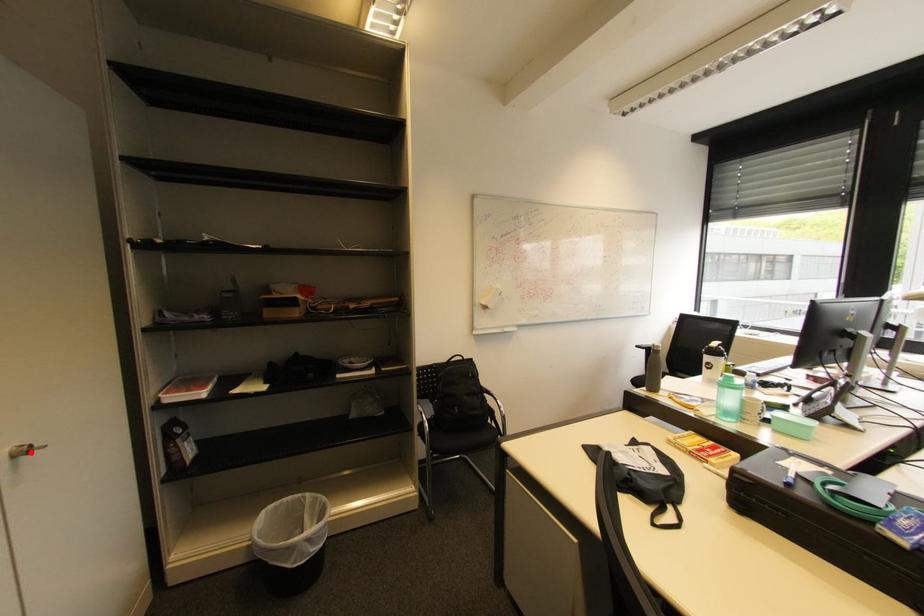
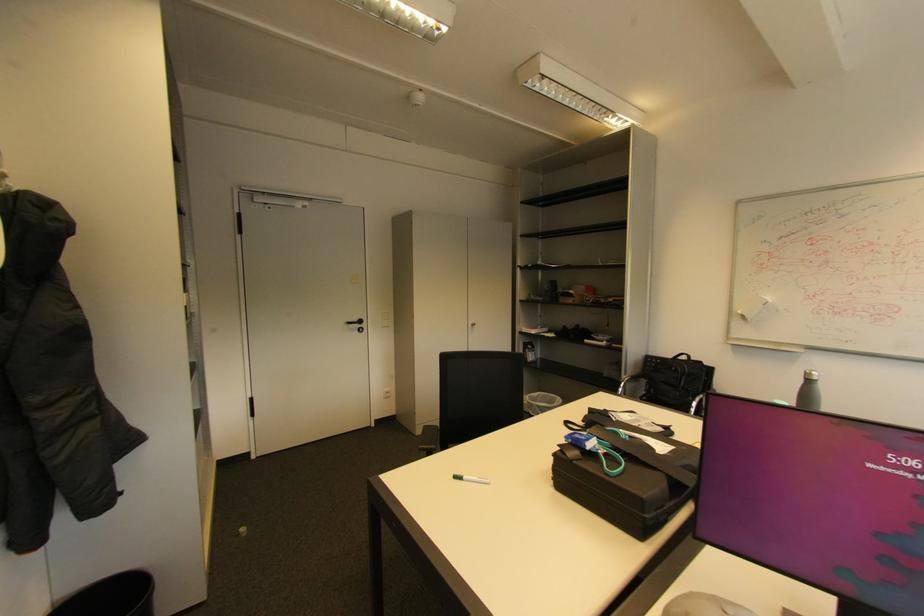
In the second image, find the point that corresponds to the highlighted location in the first image.

(479, 326)